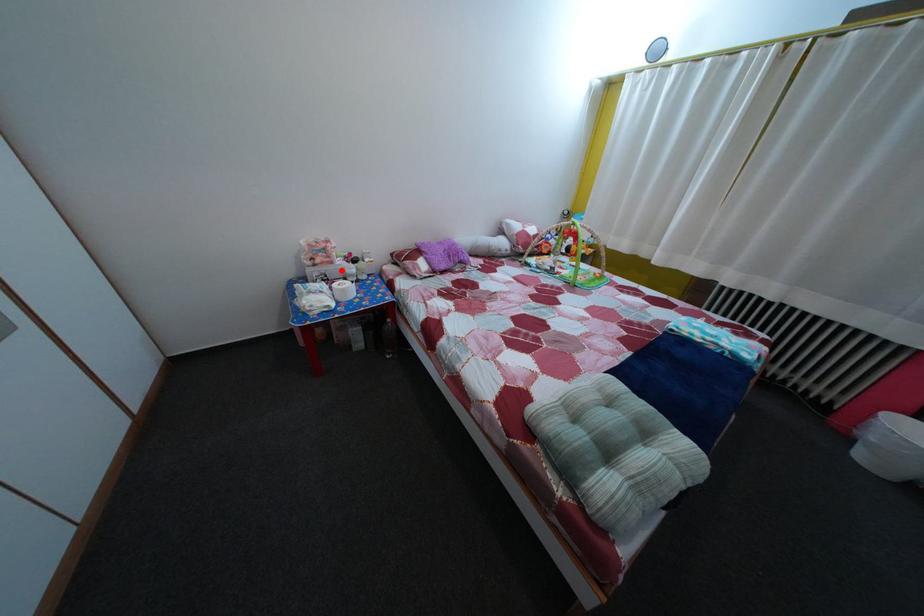
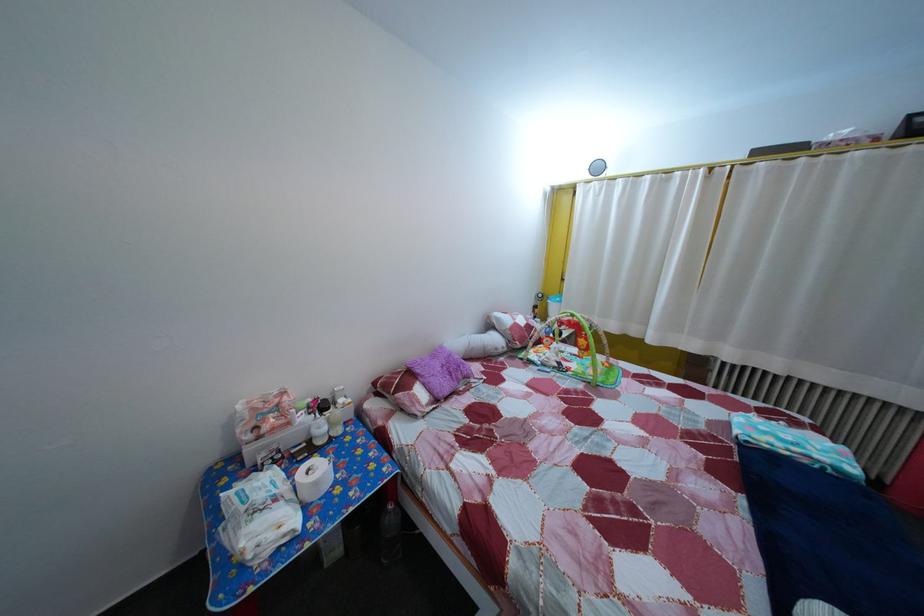
In the second image, find the point that corresponds to the highlighted location in the first image.

(298, 432)